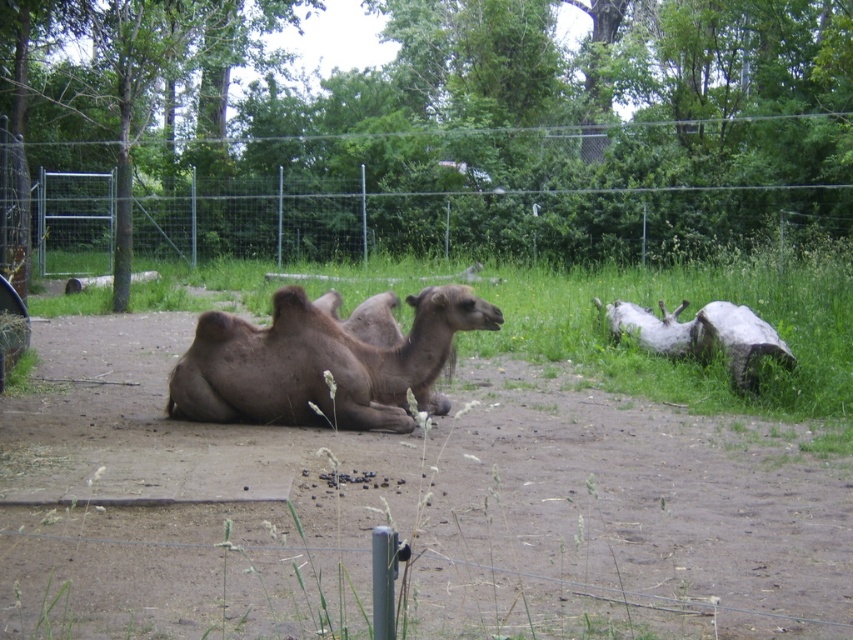
From the picture: Can you confirm if brown rough wood at right is positioned to the right of brown rough camel at center?

Yes, brown rough wood at right is to the right of brown rough camel at center.

Which is behind, point (755, 321) or point (378, 323)?

Point (755, 321)

Between point (699, 317) and point (352, 310), which one is positioned behind?

Positioned behind is point (352, 310).

Identify the location of brown rough wood at right. (701, 333).

Between brown matte camel at center and brown rough wood at right, which one has less height?

Standing shorter between the two is brown rough wood at right.

Between brown matte camel at center and brown rough wood at right, which one is positioned lower?

Positioned lower is brown matte camel at center.

Image resolution: width=853 pixels, height=640 pixels. I want to click on brown matte camel at center, so click(x=318, y=364).

Is metallic wire fence at upper center above brown matte camel at center?

Correct, metallic wire fence at upper center is located above brown matte camel at center.

Does metallic wire fence at upper center have a lesser width compared to brown matte camel at center?

No.

Does point (267, 234) come in front of point (254, 339)?

No, it is not.

Where is `metallic wire fence at upper center`? metallic wire fence at upper center is located at coordinates (469, 220).